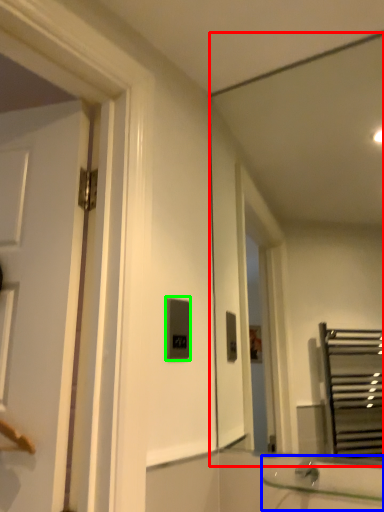
Question: Considering the real-world distances, which object is closest to mirror (highlighted by a red box)? sink (highlighted by a blue box) or light switch (highlighted by a green box).

Choices:
 (A) sink
 (B) light switch

Answer: (B)